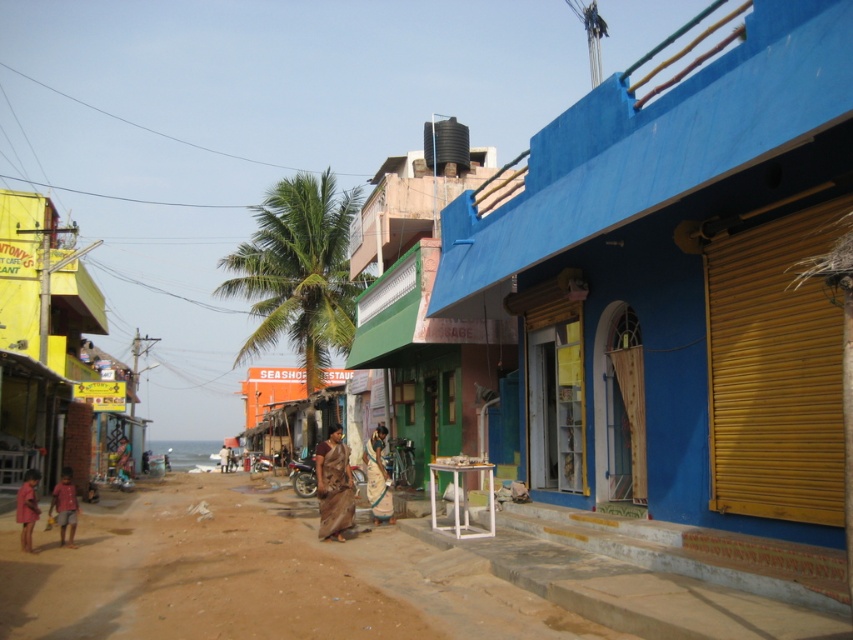
Between green leafy palm tree at center and light brown fabric saree at center, which one is positioned higher?

green leafy palm tree at center is above.

Can you confirm if green leafy palm tree at center is positioned above light brown fabric saree at center?

Correct, green leafy palm tree at center is located above light brown fabric saree at center.

Which is in front, point (318, 282) or point (381, 440)?

Point (381, 440) is more forward.

Find the location of a particular element. Image resolution: width=853 pixels, height=640 pixels. green leafy palm tree at center is located at coordinates (299, 272).

Is blue painted wall at center to the left of yellow corrugated metal hut at left from the viewer's perspective?

In fact, blue painted wall at center is to the right of yellow corrugated metal hut at left.

Between point (709, 51) and point (32, 340), which one is positioned behind?

The point (32, 340) is behind.

I want to click on blue painted wall at center, so click(682, 282).

Where is `blue painted wall at center`? This screenshot has width=853, height=640. blue painted wall at center is located at coordinates (682, 282).

Is yellow corrugated metal hut at left bigger than brown fabric dress at lower left?

Correct, yellow corrugated metal hut at left is larger in size than brown fabric dress at lower left.

Identify the location of yellow corrugated metal hut at left. The image size is (853, 640). pos(39,324).